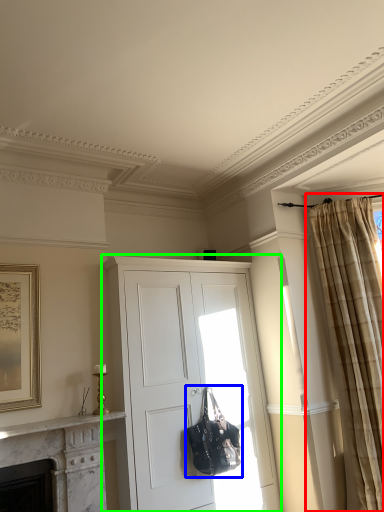
Question: Based on their relative distances, which object is nearer to curtain (highlighted by a red box)? Choose from handbag (highlighted by a blue box) and cabinetry (highlighted by a green box).

Choices:
 (A) handbag
 (B) cabinetry

Answer: (B)